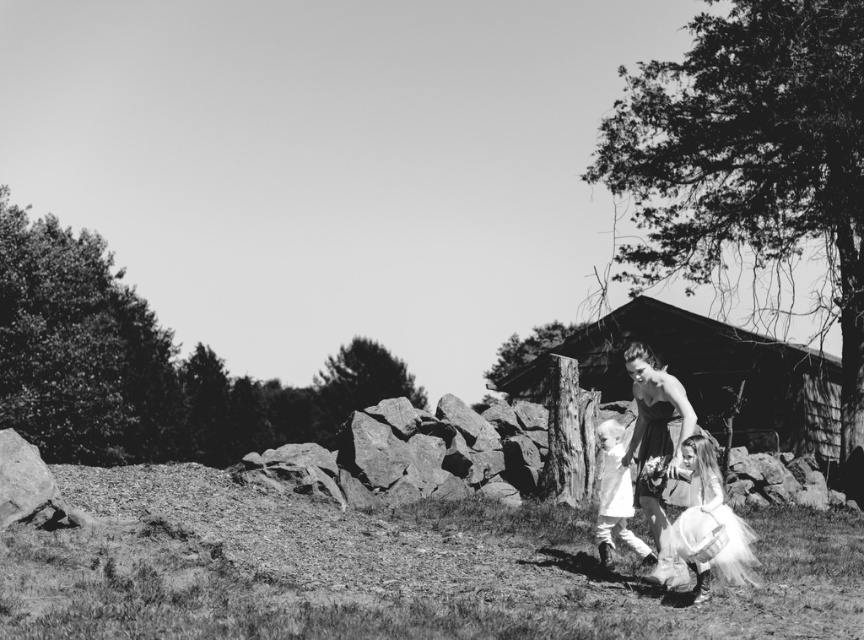
Who is more distant from viewer, (713, 492) or (602, 435)?

Point (602, 435)

Does white tulle dress at lower right have a greater width compared to white soft dress at center?

Indeed, white tulle dress at lower right has a greater width compared to white soft dress at center.

Does point (702, 474) come farther from viewer compared to point (642, 554)?

No, it is not.

Identify the location of white tulle dress at lower right. (709, 522).

Measure the distance from wooden hut at center to matte black dress at center.

wooden hut at center and matte black dress at center are 19.04 meters apart from each other.

What do you see at coordinates (706, 376) in the screenshot? This screenshot has width=864, height=640. I see `wooden hut at center` at bounding box center [706, 376].

Locate an element on the screen. wooden hut at center is located at coordinates (706, 376).

In order to click on matte black dress at center in this screenshot , I will do `click(658, 445)`.

Is matte black dress at center positioned in front of white soft dress at center?

Yes.

I want to click on matte black dress at center, so click(x=658, y=445).

The height and width of the screenshot is (640, 864). Find the location of `matte black dress at center`. matte black dress at center is located at coordinates (658, 445).